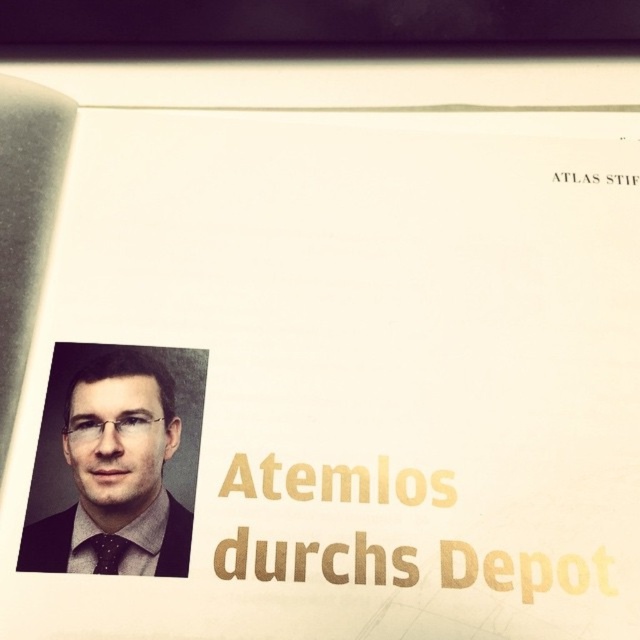
What is the spatial relationship between the matte black suit at left and the black dotted tie at lower left?

The matte black suit at left is above the black dotted tie at lower left.

You are holding a document and see a point marked at coordinates (118, 474). If your hand is 24 inches away from the document, can you touch the point without moving your hand?

The point at coordinates (118, 474) is 23.69 inches from the viewer. Since your hand is 24 inches away, you are slightly farther than the point, so you cannot touch it without moving your hand closer.

You are an assistant helping a client choose an outfit for a formal event. The client wants to know which item is wider between the matte black suit at left and the black dotted tie at lower left. Based on the image, which one is wider?

The matte black suit at left is wider than the black dotted tie at lower left according to the description.